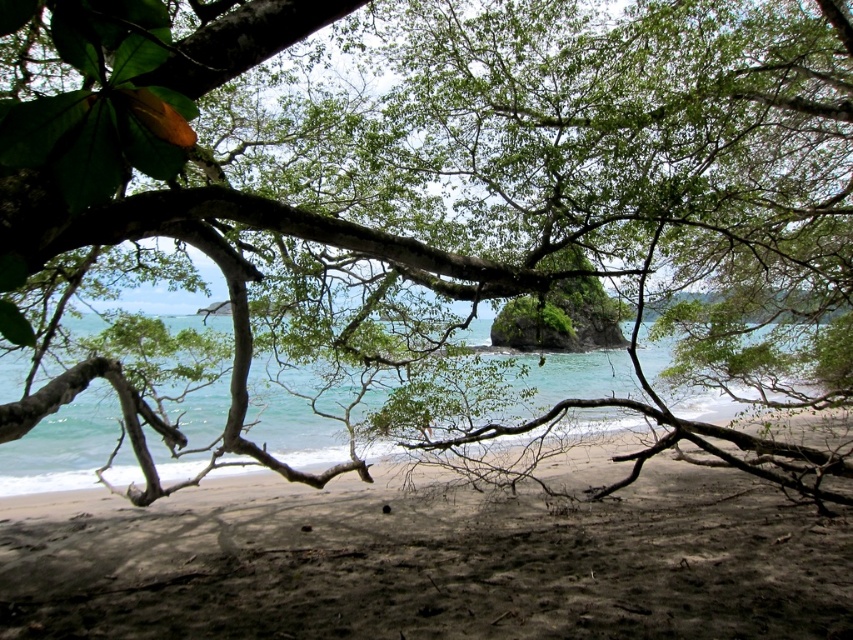
You are standing on the dark brown sandy beach at center and want to reach the clear blue water at center. According to the scene description, which direction should you move to get to the water?

The dark brown sandy beach at center is located below the clear blue water at center, so you should move upward to reach the water.

You are standing on the dark brown sandy beach at center and want to reach the clear blue water at center. Based on the scene description, which direction should you move to get closer to the water?

Since the dark brown sandy beach at center is not as tall as the clear blue water at center, you should move towards the direction where the beach slopes downward towards the water.